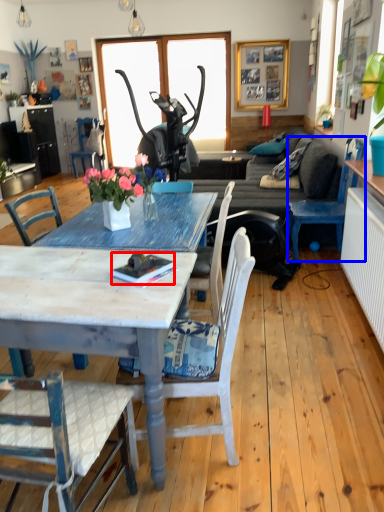
Question: Among these objects, which one is nearest to the camera, book (highlighted by a red box) or chair (highlighted by a blue box)?

Choices:
 (A) book
 (B) chair

Answer: (A)